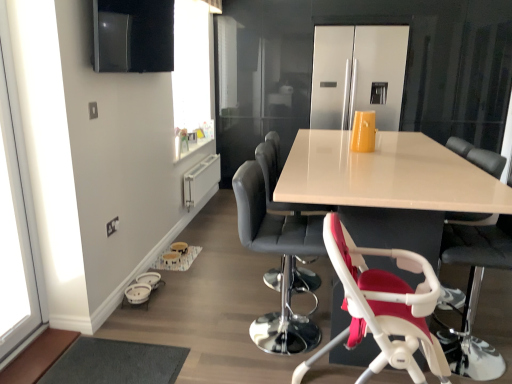
Locate an element on the screen. The image size is (512, 384). vacant area that lies in front of white plastic baby carriage at lower left is located at coordinates (140, 316).